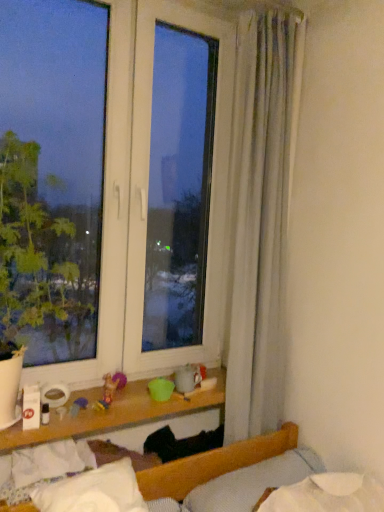
Question: Does point (215, 509) appear closer or farther from the camera than point (110, 506)?

Choices:
 (A) closer
 (B) farther

Answer: (B)

Question: From a real-world perspective, is white soft pillow at lower right, the second pillow when ordered from left to right, physically located above or below white soft pillow at lower center, the second pillow in the right-to-left sequence?

Choices:
 (A) below
 (B) above

Answer: (B)

Question: Would you say white soft pillow at lower right, the 1th pillow when ordered from right to left, is inside or outside white soft pillow at lower center, which is the first pillow from left to right?

Choices:
 (A) inside
 (B) outside

Answer: (B)

Question: Choose the correct answer: Is white soft pillow at lower center, the second pillow in the right-to-left sequence, inside white soft pillow at lower right, the second pillow when ordered from left to right, or outside it?

Choices:
 (A) inside
 (B) outside

Answer: (B)

Question: In the image, is white soft pillow at lower center, the second pillow in the right-to-left sequence, positioned in front of or behind white soft pillow at lower right, the second pillow when ordered from left to right?

Choices:
 (A) behind
 (B) front

Answer: (B)

Question: From the image's perspective, relative to white soft pillow at lower right, the 1th pillow when ordered from right to left, is white soft pillow at lower center, which is the first pillow from left to right, above or below?

Choices:
 (A) below
 (B) above

Answer: (B)

Question: Would you say white soft pillow at lower center, the second pillow in the right-to-left sequence, is to the left or to the right of white soft pillow at lower right, the second pillow when ordered from left to right, in the picture?

Choices:
 (A) left
 (B) right

Answer: (A)